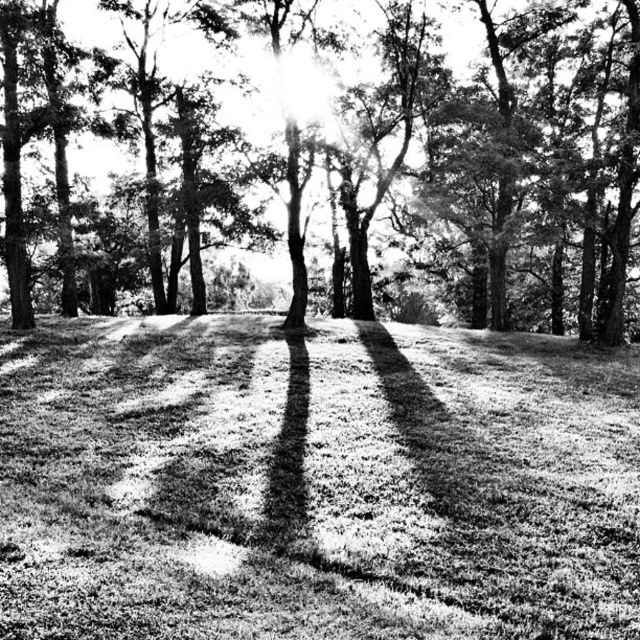
Question: Can you confirm if grassy at center is positioned to the left of smooth bark tree at center?

Choices:
 (A) no
 (B) yes

Answer: (B)

Question: Is grassy at center bigger than smooth bark tree at center?

Choices:
 (A) no
 (B) yes

Answer: (A)

Question: Which of the following is the farthest from the observer?

Choices:
 (A) (584, 44)
 (B) (8, 625)

Answer: (A)

Question: Can you confirm if grassy at center is wider than smooth bark tree at center?

Choices:
 (A) no
 (B) yes

Answer: (A)

Question: Which point is farther to the camera?

Choices:
 (A) grassy at center
 (B) smooth bark tree at center

Answer: (B)